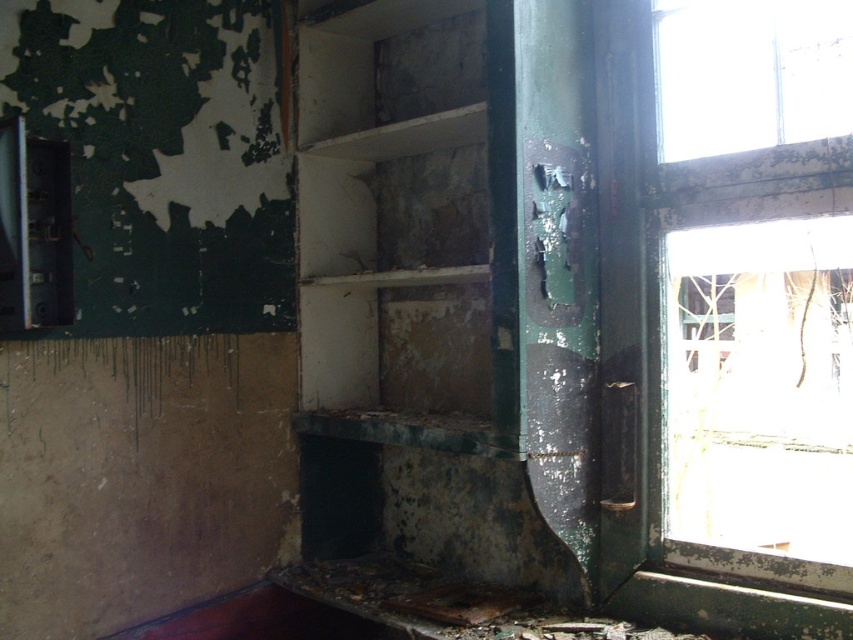
Between white matte shelf at center and green painted wood window at right, which one has more height?

green painted wood window at right

Is point (338, 51) positioned in front of point (640, 3)?

No, it is not.

Where is `white matte shelf at center`? The image size is (853, 640). white matte shelf at center is located at coordinates (410, 227).